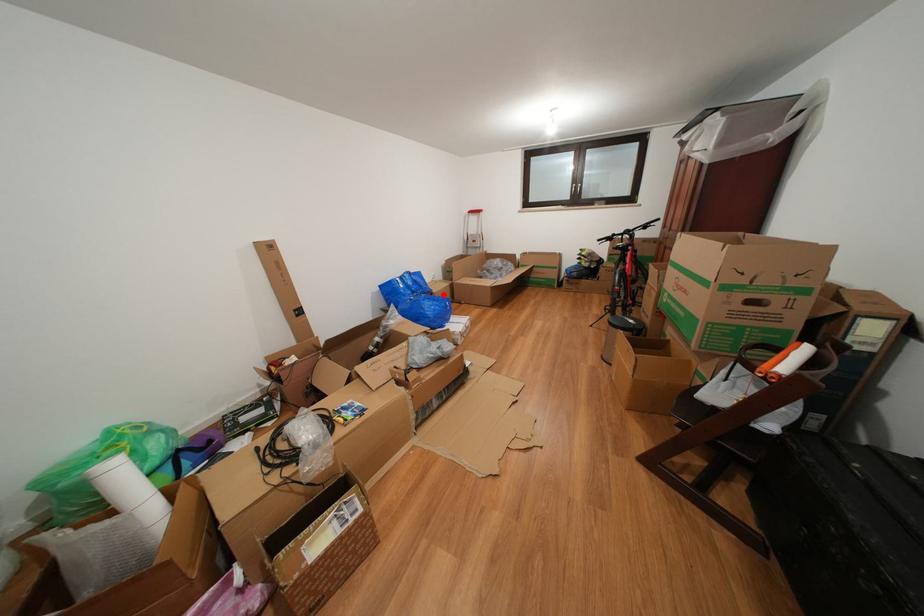
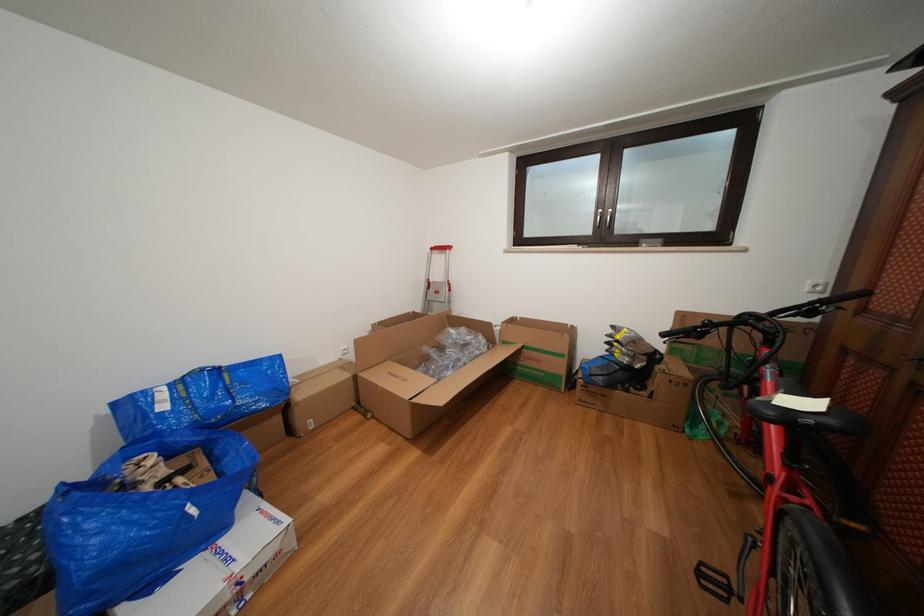
In the second image, find the point that corresponds to the highlighted location in the first image.

(309, 400)